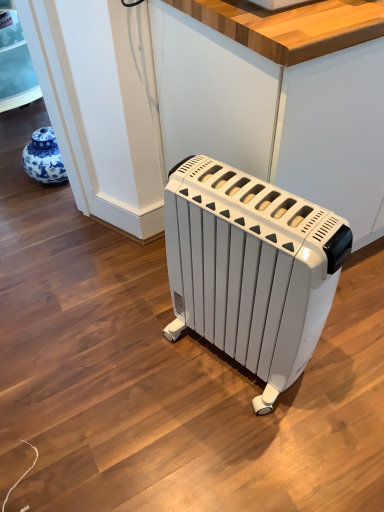
Question: Is white plastic radiator at center at the right side of wooden at center?

Choices:
 (A) yes
 (B) no

Answer: (B)

Question: Is white plastic radiator at center aimed at wooden at center?

Choices:
 (A) yes
 (B) no

Answer: (B)

Question: Can you confirm if white plastic radiator at center is wider than wooden at center?

Choices:
 (A) yes
 (B) no

Answer: (B)

Question: Is white plastic radiator at center beside wooden at center?

Choices:
 (A) yes
 (B) no

Answer: (B)

Question: Is white plastic radiator at center bigger than wooden at center?

Choices:
 (A) yes
 (B) no

Answer: (B)

Question: Does white plastic radiator at center come in front of wooden at center?

Choices:
 (A) no
 (B) yes

Answer: (B)

Question: From the image's perspective, is wooden at center under white plastic radiator at center?

Choices:
 (A) yes
 (B) no

Answer: (B)

Question: Is wooden at center turned away from white plastic radiator at center?

Choices:
 (A) no
 (B) yes

Answer: (A)

Question: Is wooden at center positioned behind white plastic radiator at center?

Choices:
 (A) yes
 (B) no

Answer: (A)

Question: From a real-world perspective, is wooden at center on top of white plastic radiator at center?

Choices:
 (A) no
 (B) yes

Answer: (B)

Question: Is wooden at center taller than white plastic radiator at center?

Choices:
 (A) yes
 (B) no

Answer: (A)

Question: Is wooden at center with white plastic radiator at center?

Choices:
 (A) no
 (B) yes

Answer: (A)

Question: From the image's perspective, is wooden at center above or below white plastic radiator at center?

Choices:
 (A) above
 (B) below

Answer: (A)